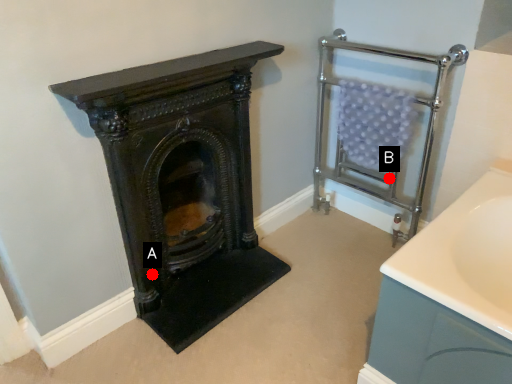
Question: Two points are circled on the image, labeled by A and B beside each circle. Which point is closer to the camera?

Choices:
 (A) A is closer
 (B) B is closer

Answer: (A)